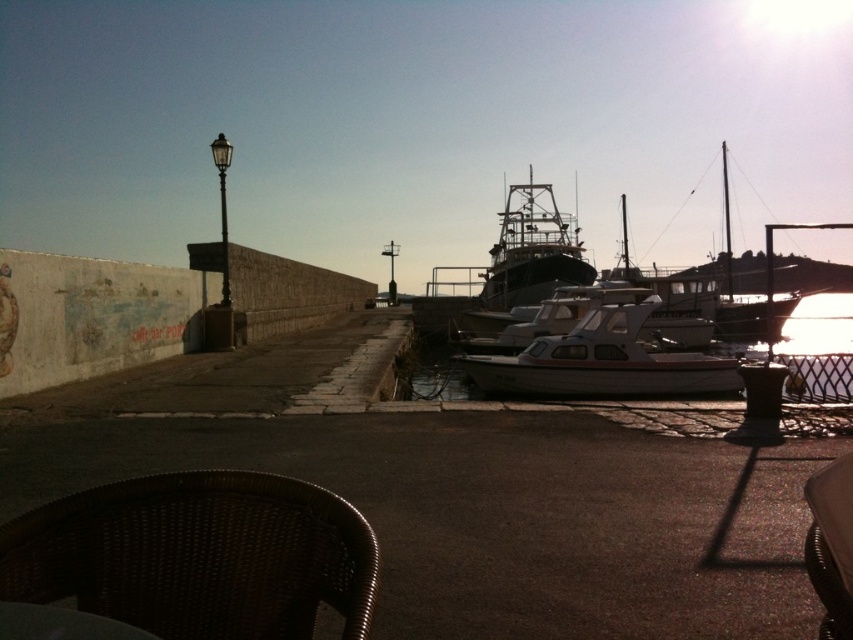
Question: Considering the relative positions of white glossy boat at center and dark green matte boat at center in the image provided, where is white glossy boat at center located with respect to dark green matte boat at center?

Choices:
 (A) above
 (B) below

Answer: (B)

Question: Estimate the real-world distances between objects in this image. Which object is farther from the brown wicker chair at lower right?

Choices:
 (A) brown wicker table at lower left
 (B) white glossy boat at center

Answer: (B)

Question: Is dark green matte boat at center smaller than brown wicker chair at lower right?

Choices:
 (A) yes
 (B) no

Answer: (B)

Question: Which point is farther to the camera?

Choices:
 (A) brown woven chair at lower left
 (B) brown wicker chair at lower right
 (C) white matte boat at center

Answer: (C)

Question: Which point is closer to the camera?

Choices:
 (A) (230, 572)
 (B) (541, 300)
 (C) (572, 294)

Answer: (A)

Question: Can you confirm if dark green matte boat at center is positioned to the right of brown wicker chair at lower right?

Choices:
 (A) no
 (B) yes

Answer: (B)